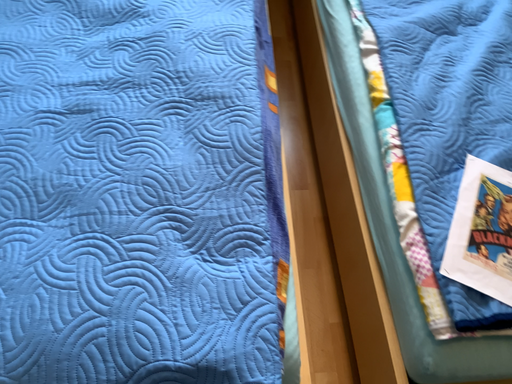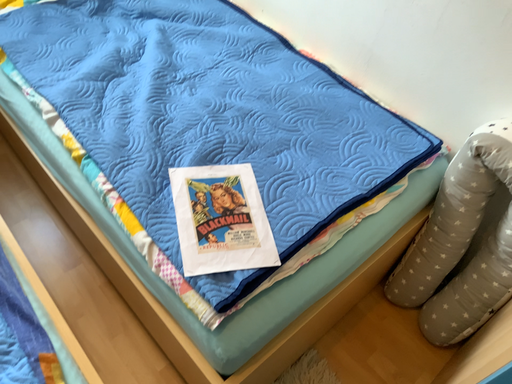
Question: Which way did the camera rotate in the video?

Choices:
 (A) rotated downward
 (B) rotated upward

Answer: (B)